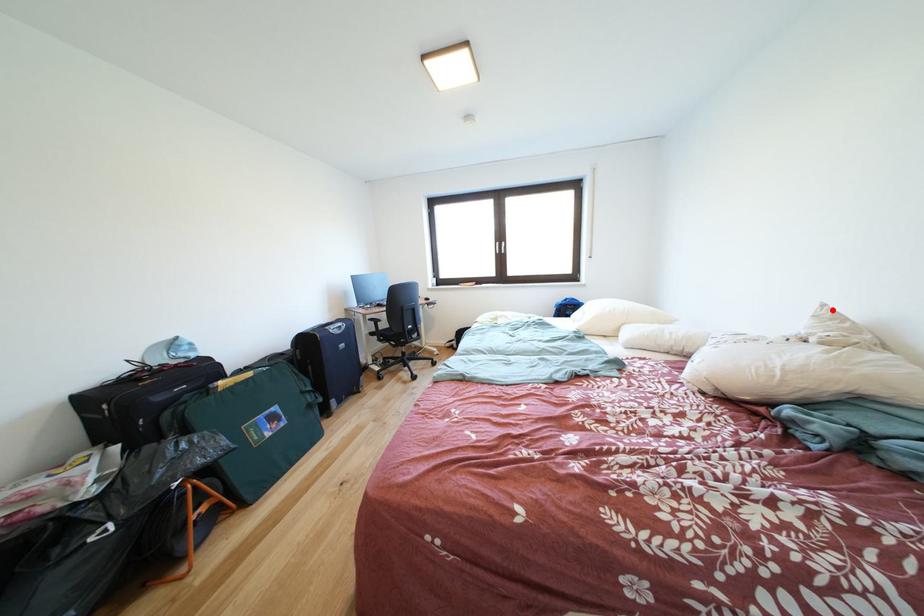
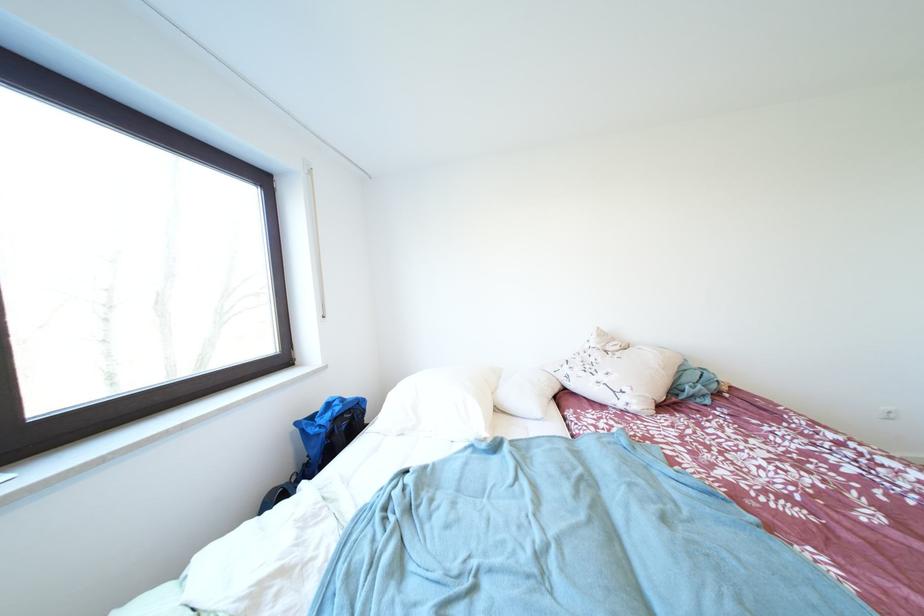
In the second image, find the point that corresponds to the highlighted location in the first image.

(606, 333)